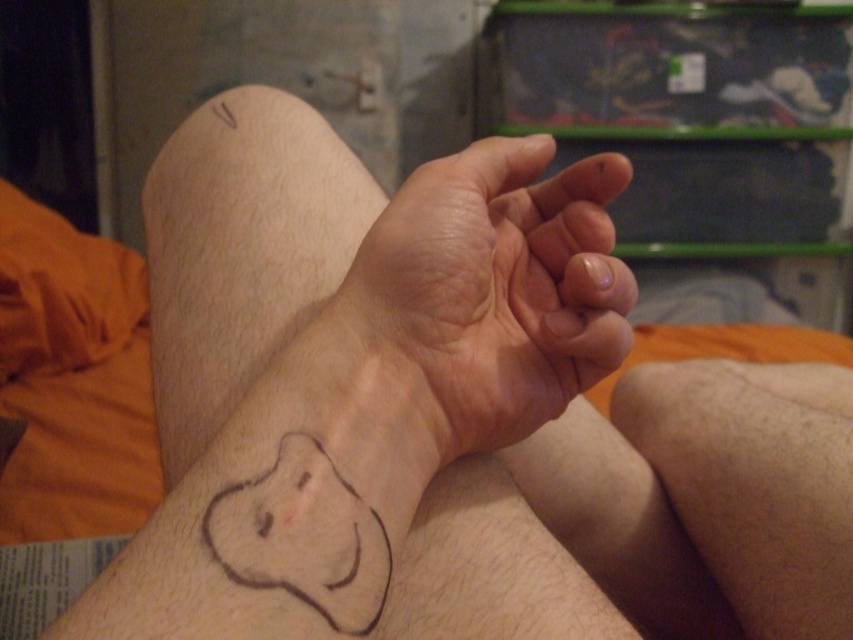
Question: Considering the relative positions of smooth skin at center and hair/fuzzy skin at lower right in the image provided, where is smooth skin at center located with respect to hair/fuzzy skin at lower right?

Choices:
 (A) below
 (B) above

Answer: (B)

Question: Is smooth skin at center wider than hair/fuzzy skin at lower right?

Choices:
 (A) yes
 (B) no

Answer: (B)

Question: Which point is farther to the camera?

Choices:
 (A) brown ink tattoo at lower left
 (B) black ink drawing at lower left

Answer: (B)

Question: Does smooth skin at center appear over hair/fuzzy skin at lower right?

Choices:
 (A) yes
 (B) no

Answer: (A)

Question: Which of the following is the farthest from the observer?

Choices:
 (A) smooth skin at center
 (B) black ink drawing at lower left
 (C) brown ink tattoo at lower left

Answer: (A)

Question: Which of the following is the closest to the observer?

Choices:
 (A) (264, 481)
 (B) (262, 460)

Answer: (A)